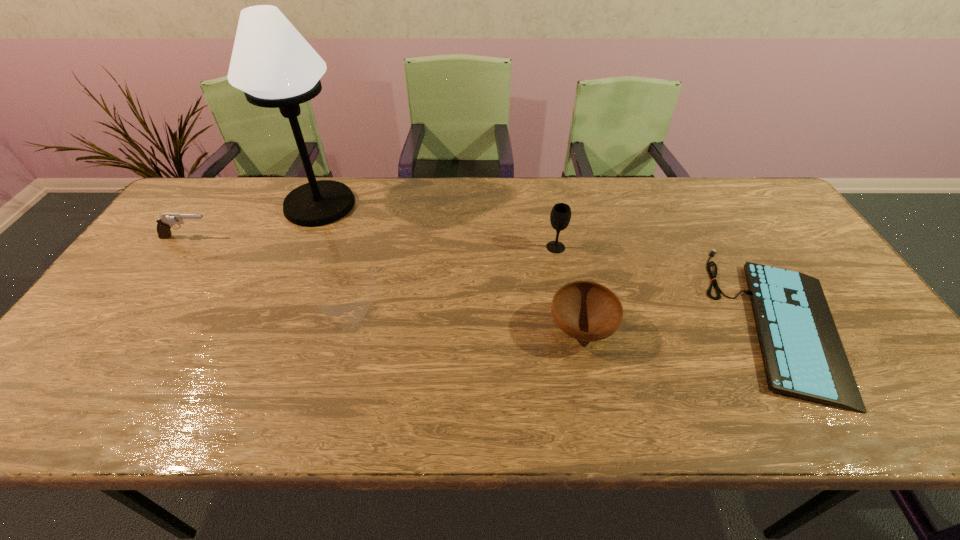
This screenshot has height=540, width=960. What are the coordinates of `vacant space at the far left corner` in the screenshot? It's located at (225, 211).

You are a GUI agent. You are given a task and a screenshot of the screen. Output one action in this format:
    pyautogui.click(x=<x>, y=<y>)
    Task: Click on the vacant area at the far right corner
    This screenshot has height=540, width=960.
    Given the screenshot: What is the action you would take?
    pyautogui.click(x=732, y=185)

This screenshot has height=540, width=960. Identify the location of unoccupied position between the second tallest object and the leftmost object. (372, 242).

At what (x,y) coordinates should I click in order to perform the action: click on vacant area between the bowl and the leftmost object. Please return your answer as a coordinate pair (x, y). The image size is (960, 540). Looking at the image, I should click on (385, 283).

Locate an element on the screen. This screenshot has width=960, height=540. vacant space that is in between the bowl and the gun is located at coordinates (385, 283).

Identify the location of free point between the rightmost object and the tallest object. Image resolution: width=960 pixels, height=540 pixels. (551, 262).

Find the location of `vacant space in between the computer keyboard and the wineglass`. vacant space in between the computer keyboard and the wineglass is located at coordinates (669, 283).

This screenshot has width=960, height=540. I want to click on blank region between the table lamp and the bowl, so click(451, 267).

Identify the location of free spot between the gun and the table lamp. (253, 221).

Where is `empty space between the computer keyboard and the bowl`? The width and height of the screenshot is (960, 540). empty space between the computer keyboard and the bowl is located at coordinates (682, 324).